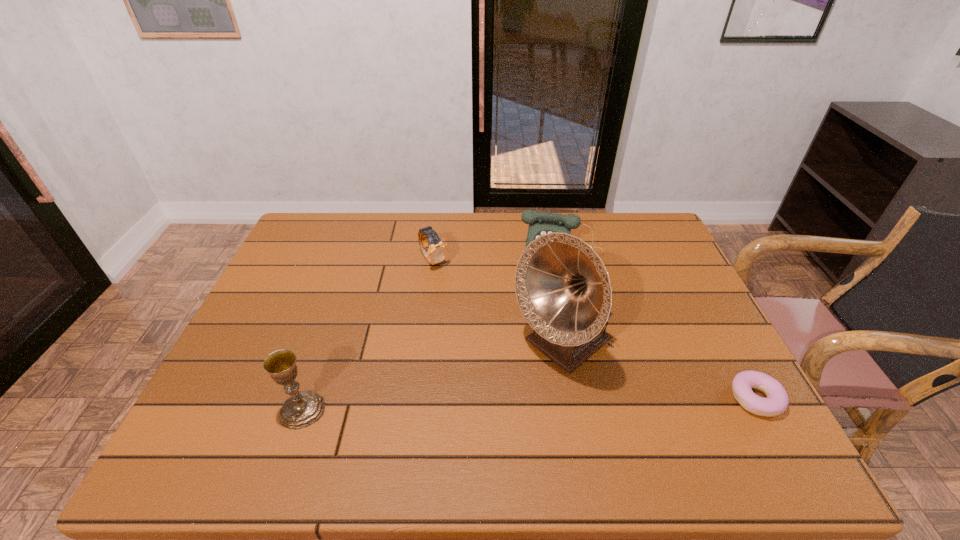
You are a GUI agent. You are given a task and a screenshot of the screen. Output one action in this format:
    pyautogui.click(x=<x>, y=<y>)
    Task: Click on the leftmost object
    
    Given the screenshot: What is the action you would take?
    pyautogui.click(x=303, y=408)

The height and width of the screenshot is (540, 960). I want to click on chalice, so click(303, 408).

Find the location of `the shortest object`. the shortest object is located at coordinates (777, 400).

What are the coordinates of `doughnut` in the screenshot? It's located at (777, 400).

The width and height of the screenshot is (960, 540). Identify the location of watch. (436, 252).

What are the coordinates of `the second shortest object` in the screenshot? It's located at click(x=436, y=252).

Where is `the tallest object`? The width and height of the screenshot is (960, 540). the tallest object is located at coordinates (563, 289).

Where is `telephone`? telephone is located at coordinates point(540,223).

Image resolution: width=960 pixels, height=540 pixels. Identify the location of vacant position located 0.090m on the left of the fourth shortest object. (240, 409).

You are a GUI agent. You are given a task and a screenshot of the screen. Output one action in this format:
    pyautogui.click(x=<x>, y=<y>)
    Task: Click on the blank space located on the left of the doughnut
    The width and height of the screenshot is (960, 540).
    Given the screenshot: What is the action you would take?
    pyautogui.click(x=651, y=399)